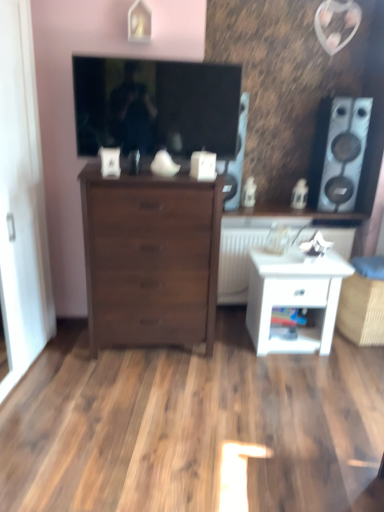
Locate an element on the screen. free spot to the left of white glossy nightstand at lower right is located at coordinates (226, 339).